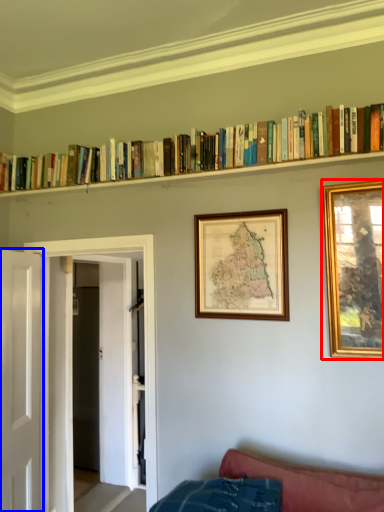
Question: Which point is closer to the camera, picture frame (highlighted by a red box) or door (highlighted by a blue box)?

Choices:
 (A) picture frame
 (B) door

Answer: (A)